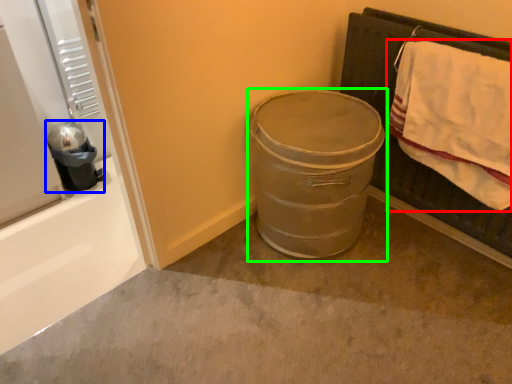
Question: Based on their relative distances, which object is nearer to bath towel (highlighted by a red box)? Choose from appliance (highlighted by a blue box) and trash bin/can (highlighted by a green box).

Choices:
 (A) appliance
 (B) trash bin/can

Answer: (B)